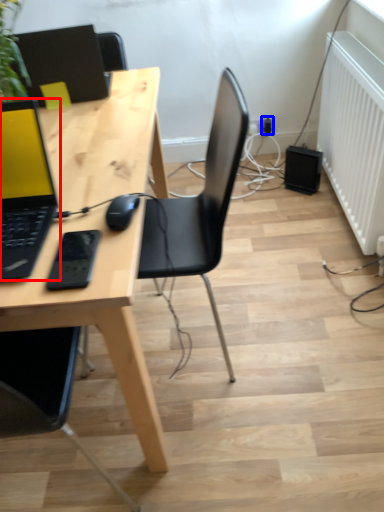
Question: Which object appears farthest to the camera in this image, laptop (highlighted by a red box) or electric outlet (highlighted by a blue box)?

Choices:
 (A) laptop
 (B) electric outlet

Answer: (B)